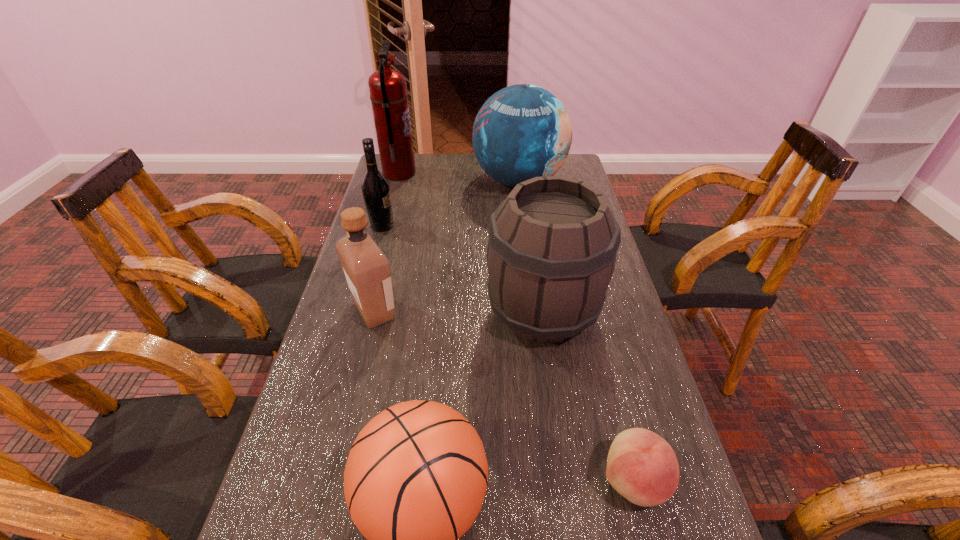
The height and width of the screenshot is (540, 960). Find the location of `free point located on the label of the third farthest object`. free point located on the label of the third farthest object is located at coordinates (443, 226).

This screenshot has width=960, height=540. I want to click on vacant space located 0.390m on the back of the peach, so click(588, 303).

At what (x,y) coordinates should I click in order to perform the action: click on fire extinguisher present at the far edge. Please return your answer as a coordinate pair (x, y). Looking at the image, I should click on (388, 90).

Locate an element on the screen. globe positioned at the far edge is located at coordinates (523, 131).

Image resolution: width=960 pixels, height=540 pixels. I want to click on fire extinguisher that is at the left edge, so click(388, 90).

Locate an element on the screen. This screenshot has height=540, width=960. liquor present at the left edge is located at coordinates (367, 270).

I want to click on wine bottle situated at the left edge, so click(376, 192).

Locate an element on the screen. globe that is at the right edge is located at coordinates [523, 131].

The width and height of the screenshot is (960, 540). Identify the location of wine bucket located at the right edge. (552, 245).

Find the location of a particular element. This screenshot has width=960, height=540. peach situated at the right edge is located at coordinates (641, 466).